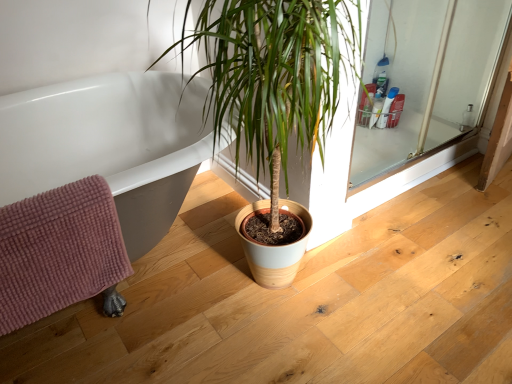
Question: Looking at the image, does pink textured bath towel at lower left seem bigger or smaller compared to clear glass screen door at upper right?

Choices:
 (A) small
 (B) big

Answer: (A)

Question: Would you say pink textured bath towel at lower left is to the left or to the right of clear glass screen door at upper right in the picture?

Choices:
 (A) left
 (B) right

Answer: (A)

Question: From their relative heights in the image, would you say pink textured bath towel at lower left is taller or shorter than clear glass screen door at upper right?

Choices:
 (A) short
 (B) tall

Answer: (A)

Question: Considering the positions of clear glass screen door at upper right and pink textured bath towel at lower left in the image, is clear glass screen door at upper right wider or thinner than pink textured bath towel at lower left?

Choices:
 (A) thin
 (B) wide

Answer: (A)

Question: Is clear glass screen door at upper right to the left or to the right of pink textured bath towel at lower left in the image?

Choices:
 (A) right
 (B) left

Answer: (A)

Question: From a real-world perspective, is clear glass screen door at upper right physically located above or below pink textured bath towel at lower left?

Choices:
 (A) above
 (B) below

Answer: (B)

Question: Considering the positions of clear glass screen door at upper right and pink textured bath towel at lower left in the image, is clear glass screen door at upper right taller or shorter than pink textured bath towel at lower left?

Choices:
 (A) short
 (B) tall

Answer: (B)